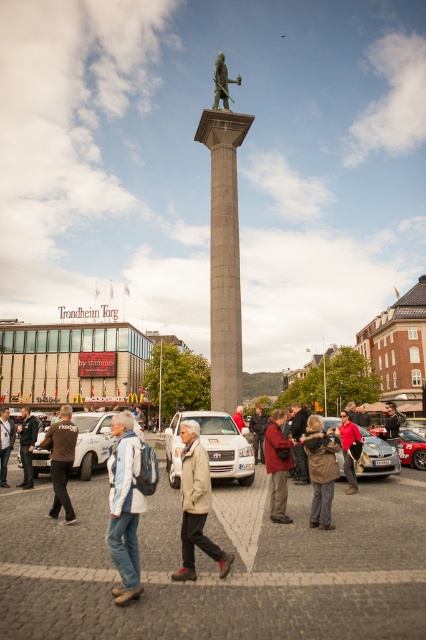
Question: Can you confirm if light brown leather jacket at center is smaller than bronze statue at center?

Choices:
 (A) no
 (B) yes

Answer: (A)

Question: Among these points, which one is nearest to the camera?

Choices:
 (A) (319, 515)
 (B) (370, 449)
 (C) (132, 536)

Answer: (C)

Question: Does red woolen sweater at center have a smaller size compared to metallic silver car at center?

Choices:
 (A) yes
 (B) no

Answer: (B)

Question: Which point is farther to the camera?

Choices:
 (A) dark brown leather jacket at center
 (B) light blue denim jacket at lower left
 (C) silver metallic car at lower center
 (D) brown leather jacket at center

Answer: (A)

Question: Which is farther from the dark gray jacket at center?

Choices:
 (A) brown fuzzy coat at center
 (B) dark brown leather jacket at center
 (C) white matte van at center
 (D) light brown leather jacket at lower left

Answer: (D)

Question: Is light blue denim jacket at lower left bigger than light brown leather jacket at lower left?

Choices:
 (A) yes
 (B) no

Answer: (B)